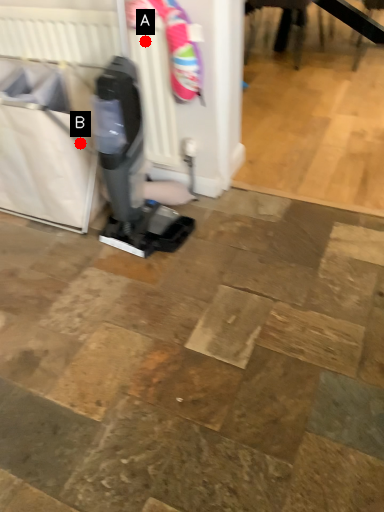
Question: Two points are circled on the image, labeled by A and B beside each circle. Which point appears closest to the camera in this image?

Choices:
 (A) A is closer
 (B) B is closer

Answer: (A)